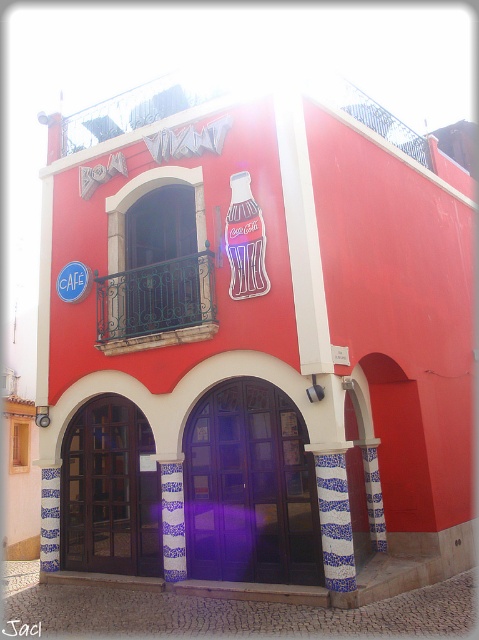
Between point (259, 556) and point (181, 572), which one is positioned behind?

The point (181, 572) is behind.

Image resolution: width=479 pixels, height=640 pixels. I want to click on purple wooden door at center, so click(x=250, y=488).

Which is in front, point (278, 417) or point (163, 499)?

Point (278, 417)

The image size is (479, 640). Find the location of `purple wooden door at center`. purple wooden door at center is located at coordinates (250, 488).

Between black wrought iron at center and blue and white striped pillar at center, which one is positioned higher?

Positioned higher is black wrought iron at center.

Between black wrought iron at center and blue and white striped pillar at center, which one appears on the left side from the viewer's perspective?

black wrought iron at center is more to the left.

Which is in front, point (136, 268) or point (351, 576)?

Point (351, 576) is more forward.

This screenshot has width=479, height=640. Identify the location of black wrought iron at center. (157, 305).

From the picture: Is blue and white striped pillar at center below blue plastic cafe sign at upper left?

Yes, blue and white striped pillar at center is below blue plastic cafe sign at upper left.

Does blue and white striped pillar at center have a lesser height compared to blue plastic cafe sign at upper left?

No.

Identify the location of blue and white striped pillar at center. This screenshot has width=479, height=640. (335, 524).